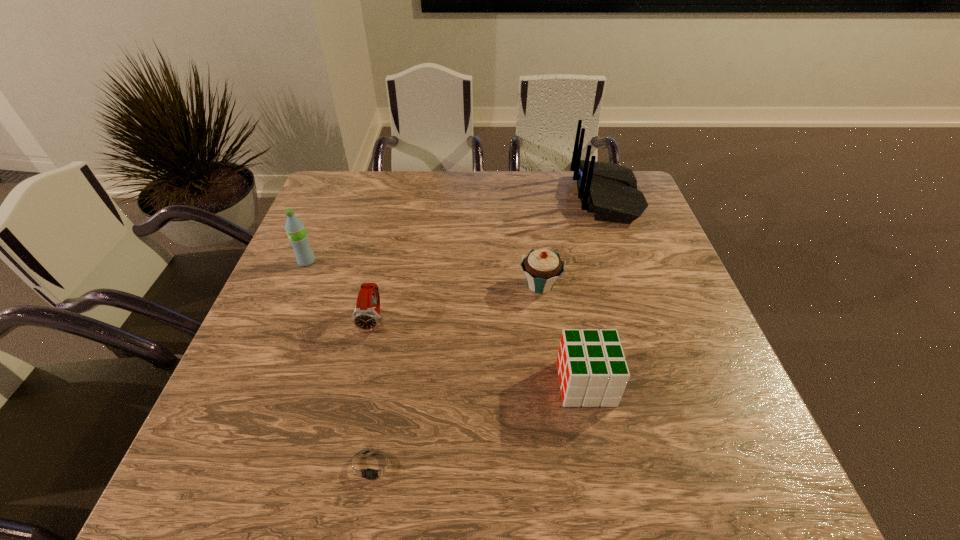
Where is `the farthest object`? the farthest object is located at coordinates (608, 190).

At what (x,y) coordinates should I click in order to perform the action: click on router. Please return your answer as a coordinate pair (x, y). The image size is (960, 540). Looking at the image, I should click on (608, 190).

Locate an element on the screen. The height and width of the screenshot is (540, 960). the fifth nearest object is located at coordinates (295, 229).

Where is `water bottle`? water bottle is located at coordinates 295,229.

Identify the location of cupcake. This screenshot has height=540, width=960. 542,268.

At what (x,y) coordinates should I click in order to perform the action: click on the second nearest object. Please return your answer as a coordinate pair (x, y). This screenshot has width=960, height=540. Looking at the image, I should click on (593, 372).

Locate an element on the screen. The height and width of the screenshot is (540, 960). the farther watch is located at coordinates (365, 317).

I want to click on the fourth farthest object, so click(x=365, y=317).

This screenshot has height=540, width=960. I want to click on the nearer watch, so click(x=373, y=467).

This screenshot has width=960, height=540. Find the location of `the shorter watch`. the shorter watch is located at coordinates (373, 467).